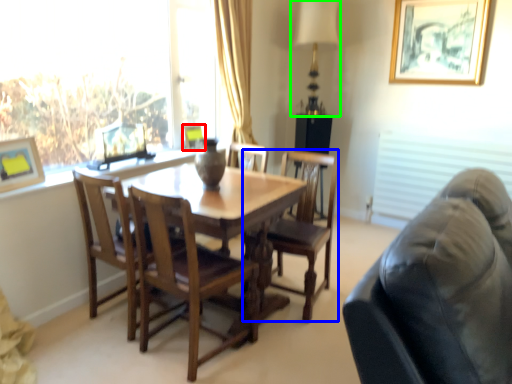
Question: Estimate the real-world distances between objects in this image. Which object is closer to picture frame (highlighted by a red box), chair (highlighted by a blue box) or table lamp (highlighted by a green box)?

Choices:
 (A) chair
 (B) table lamp

Answer: (A)